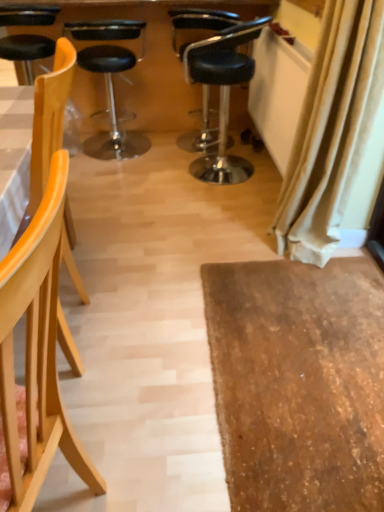
Question: From a real-world perspective, is black leather stool at center, the second chair when ordered from back to front, positioned over light wood chair at left, acting as the 2th chair starting from the front, based on gravity?

Choices:
 (A) no
 (B) yes

Answer: (A)

Question: From the image's perspective, would you say black leather stool at center, the second chair when ordered from back to front, is shown under light wood chair at left, the 4th chair viewed from the back?

Choices:
 (A) no
 (B) yes

Answer: (A)

Question: Considering the relative sizes of black leather stool at center, the fourth chair viewed from the front, and light wood chair at left, acting as the 2th chair starting from the front, in the image provided, is black leather stool at center, the fourth chair viewed from the front, smaller than light wood chair at left, acting as the 2th chair starting from the front,?

Choices:
 (A) yes
 (B) no

Answer: (B)

Question: From a real-world perspective, is black leather stool at center, the fourth chair viewed from the front, below light wood chair at left, the 4th chair viewed from the back?

Choices:
 (A) no
 (B) yes

Answer: (B)

Question: Can you confirm if black leather stool at center, the fourth chair viewed from the front, is thinner than light wood chair at left, the 4th chair viewed from the back?

Choices:
 (A) no
 (B) yes

Answer: (A)

Question: Considering their positions, is beige fabric curtain at right located in front of or behind black leather chair at center, which appears as the first chair when viewed from the back?

Choices:
 (A) behind
 (B) front

Answer: (B)

Question: In the image, is beige fabric curtain at right on the left side or the right side of black leather chair at center, arranged as the 5th chair when viewed from the front?

Choices:
 (A) right
 (B) left

Answer: (A)

Question: Based on their sizes in the image, would you say beige fabric curtain at right is bigger or smaller than black leather chair at center, arranged as the 5th chair when viewed from the front?

Choices:
 (A) big
 (B) small

Answer: (B)

Question: From the image's perspective, is beige fabric curtain at right above or below black leather chair at center, arranged as the 5th chair when viewed from the front?

Choices:
 (A) above
 (B) below

Answer: (B)

Question: Is point (34, 482) positioned closer to the camera than point (210, 95)?

Choices:
 (A) farther
 (B) closer

Answer: (B)

Question: Based on their positions, is light wood chair at left, the 5th chair in the back-to-front sequence, located to the left or right of black leather desk at upper center?

Choices:
 (A) right
 (B) left

Answer: (A)

Question: Looking at their shapes, would you say light wood chair at left, the 5th chair in the back-to-front sequence, is wider or thinner than black leather desk at upper center?

Choices:
 (A) thin
 (B) wide

Answer: (A)

Question: From their relative heights in the image, would you say light wood chair at left, the 5th chair in the back-to-front sequence, is taller or shorter than black leather desk at upper center?

Choices:
 (A) short
 (B) tall

Answer: (B)

Question: From a real-world perspective, is black leather chair at center, which appears as the first chair when viewed from the back, positioned above or below light wood chair at left, the 4th chair viewed from the back?

Choices:
 (A) below
 (B) above

Answer: (A)

Question: Is point (196, 150) closer or farther from the camera than point (44, 86)?

Choices:
 (A) closer
 (B) farther

Answer: (B)